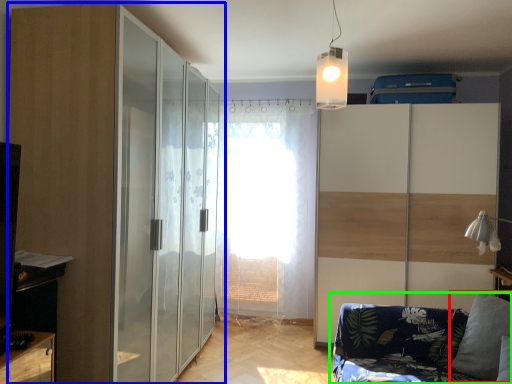
Question: Which is nearer to the pillow (highlighted by a red box)? door (highlighted by a blue box) or studio couch (highlighted by a green box).

Choices:
 (A) door
 (B) studio couch

Answer: (B)